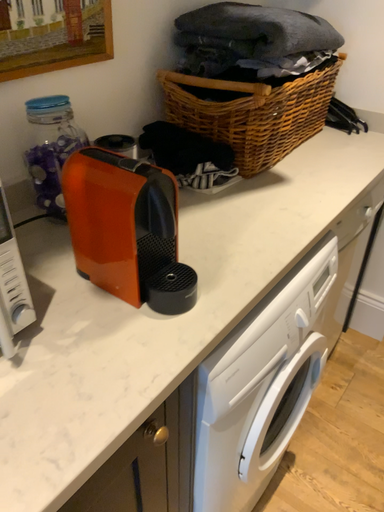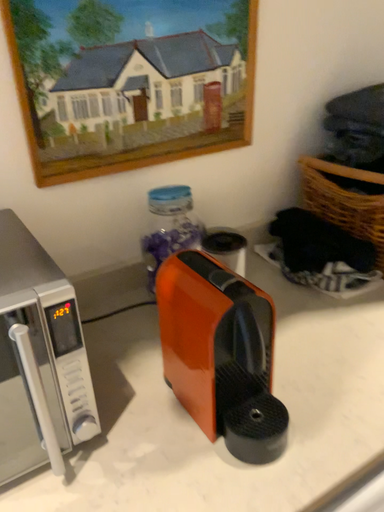
Question: Which way did the camera rotate in the video?

Choices:
 (A) rotated downward
 (B) rotated upward

Answer: (B)